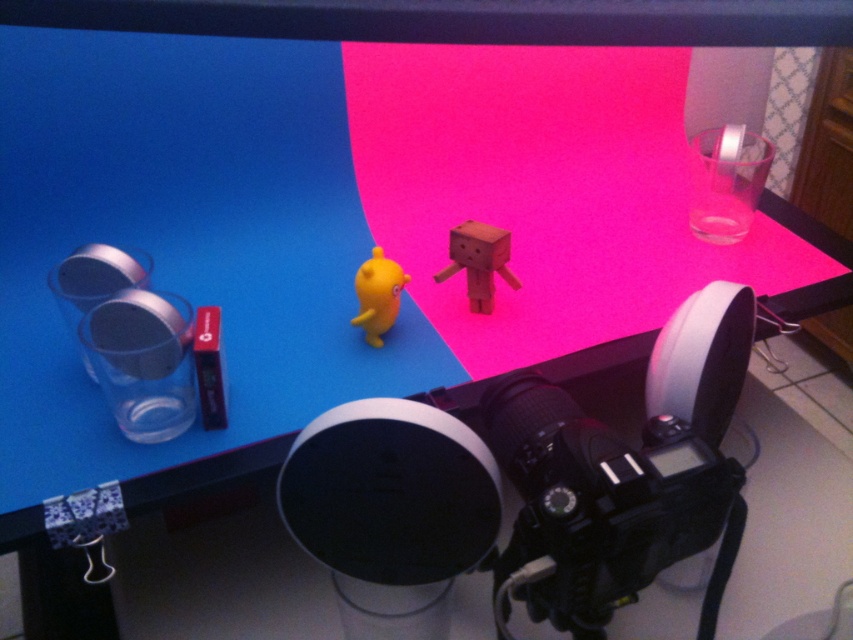
You are setting up a photo shoot and need to place the black plastic video camera at center and the matte yellow rubber duck at center in the frame. Since both are at the center, how can you ensure they don t overlap?

The black plastic video camera at center is larger in size than the matte yellow rubber duck at center, so you can position the smaller duck slightly to one side of the camera to prevent overlap while keeping them both centered.

Based on the photo, you are setting up a camera shot for a product photo. The scene includes a wooden block at center and a matte yellow rubber duck at center. Which object should you focus on if you want to capture the larger subject in your frame?

You should focus on the wooden block at center because it has a larger size compared to the matte yellow rubber duck at center.